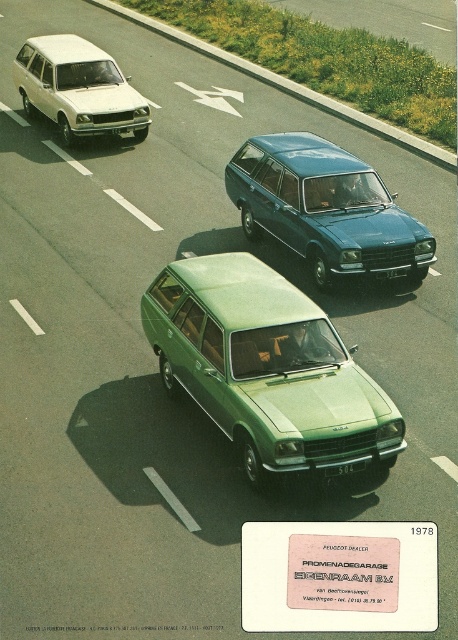
You are a photographer standing on a bridge overlooking a road with two vintage Peugeot station wagons. You notice the green matte station wagon at center and the teal metallic station wagon at center. Which one is positioned to the left when viewed from your perspective?

The green matte station wagon at center is positioned to the left of the teal metallic station wagon at center.

You are a photographer standing at the scene of the Peugeot advertisement. You want to take a photo that clearly shows both the green matte station wagon at center and the teal metallic station wagon at center. Which wagon should you adjust your camera angle to focus on first to ensure both are in frame?

The green matte station wagon at center is positioned under the teal metallic station wagon at center, so you should focus on the teal metallic station wagon at center first to ensure both are visible in the frame.